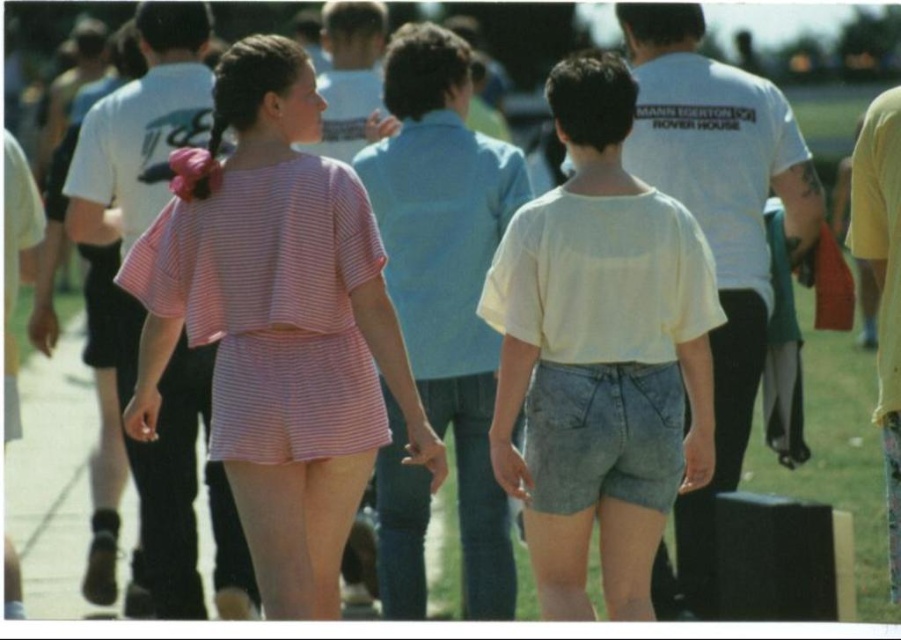
Who is taller, pink striped fabric shorts at center or light yellow cotton shirt at center?

pink striped fabric shorts at center is taller.

How far apart are pink striped fabric shorts at center and light yellow cotton shirt at center?

The distance of pink striped fabric shorts at center from light yellow cotton shirt at center is 36.22 inches.

What do you see at coordinates (279, 326) in the screenshot? I see `pink striped fabric shorts at center` at bounding box center [279, 326].

Where is `pink striped fabric shorts at center`? The width and height of the screenshot is (901, 640). pink striped fabric shorts at center is located at coordinates (279, 326).

Which is in front, point (187, 241) or point (444, 420)?

Point (187, 241) is more forward.

Which is behind, point (283, 141) or point (478, 177)?

The point (478, 177) is more distant.

What are the coordinates of `pink striped fabric shorts at center` in the screenshot? It's located at click(279, 326).

Measure the distance between point (x=608, y=456) and camera.

Point (x=608, y=456) and camera are 6.48 meters apart from each other.

Is light yellow cotton shirt at center thinner than pink striped shirt at center?

No.

Does point (545, 387) come closer to viewer compared to point (467, 150)?

Yes.

The height and width of the screenshot is (640, 901). What are the coordinates of `light yellow cotton shirt at center` in the screenshot? It's located at [x=599, y=355].